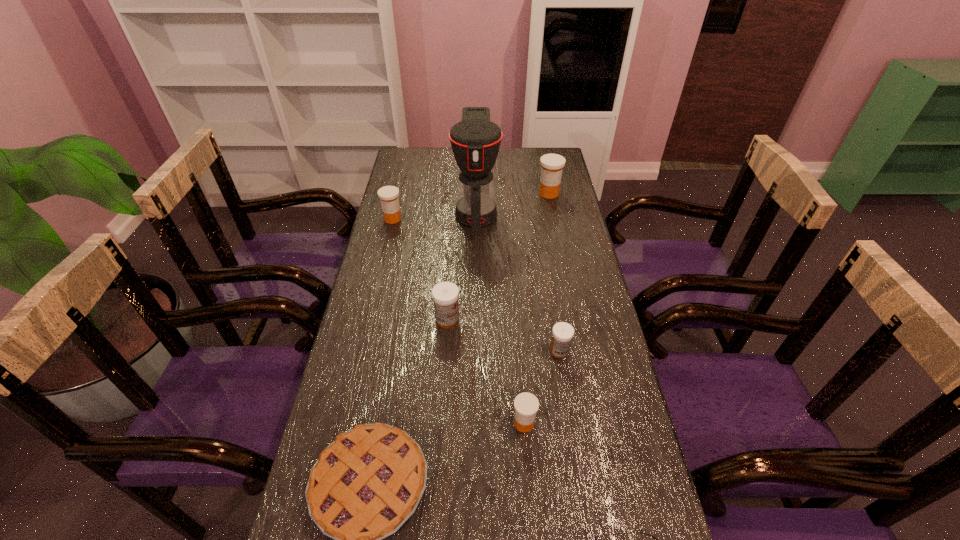
In the image, there is a desktop. Where is `vacant space at the far edge`? The width and height of the screenshot is (960, 540). vacant space at the far edge is located at coordinates (498, 160).

This screenshot has width=960, height=540. I want to click on vacant space at the left edge, so click(414, 251).

In the image, there is a desktop. Where is `vacant area at the right edge`? vacant area at the right edge is located at coordinates (564, 288).

In the image, there is a desktop. Find the location of `free space at the far left corner`. free space at the far left corner is located at coordinates (435, 154).

Locate an element on the screen. The image size is (960, 540). vacant area that lies between the fourth nearest object and the third farthest medicine is located at coordinates (503, 335).

I want to click on vacant area that lies between the left white medicine and the second smallest orange medicine, so click(x=420, y=269).

The image size is (960, 540). I want to click on unoccupied position between the farthest medicine and the coffee maker, so click(513, 203).

Identify the location of the seventh closest object to the rightmost orange medicine. The width and height of the screenshot is (960, 540). (596, 536).

The image size is (960, 540). I want to click on object identified as the third closest to the pie, so click(x=596, y=536).

Find the location of a particular element. The height and width of the screenshot is (540, 960). medicine that is the second nearest to the bigger white medicine is located at coordinates (526, 405).